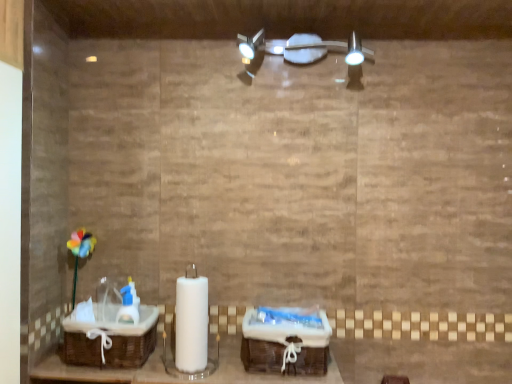
Question: Visually, is brown woven basket at lower left positioned to the left or to the right of satin nickel light fixture at upper center?

Choices:
 (A) right
 (B) left

Answer: (B)

Question: In the image, is brown woven basket at lower left positioned in front of or behind satin nickel light fixture at upper center?

Choices:
 (A) front
 (B) behind

Answer: (A)

Question: Which of these objects is positioned closest to the woven brown baskets at center?

Choices:
 (A) satin nickel light fixture at upper center
 (B) brown woven basket at lower left

Answer: (B)

Question: Which of these objects is positioned farthest from the woven brown baskets at center?

Choices:
 (A) satin nickel light fixture at upper center
 (B) brown woven basket at lower left

Answer: (A)